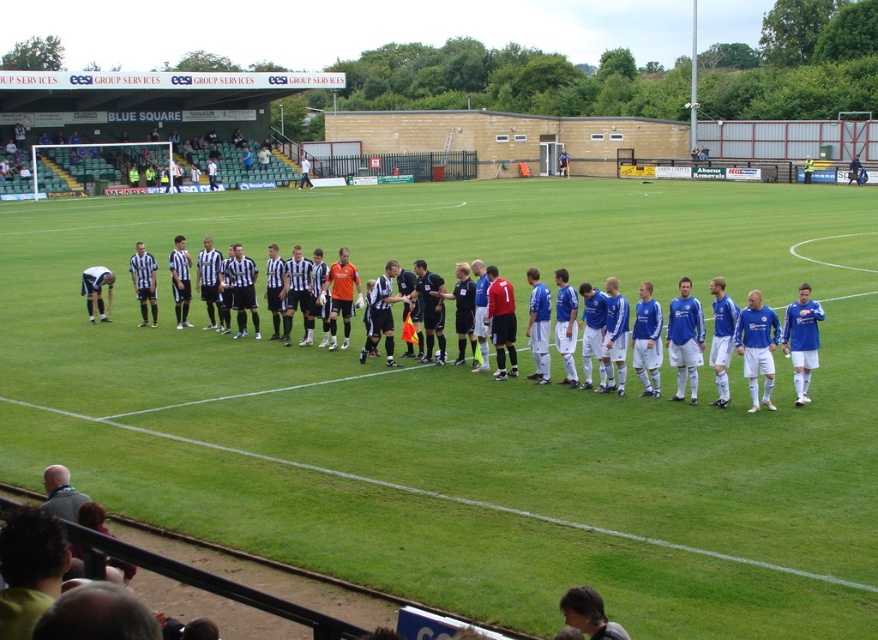
Between smooth brown hair at lower center and light brown leather jacket at lower left, which one appears on the left side from the viewer's perspective?

light brown leather jacket at lower left is more to the left.

Does point (594, 604) come closer to viewer compared to point (59, 486)?

Yes, it is.

Identify the location of smooth brown hair at lower center. The width and height of the screenshot is (878, 640). (588, 612).

Consider the image. Which is more to the right, light brown leather jacket at lower left or striped jersey at center?

light brown leather jacket at lower left is more to the right.

Can you confirm if light brown leather jacket at lower left is positioned to the right of striped jersey at center?

Indeed, light brown leather jacket at lower left is positioned on the right side of striped jersey at center.

Between point (65, 480) and point (131, 262), which one is positioned behind?

Positioned behind is point (131, 262).

Locate an element on the screen. The width and height of the screenshot is (878, 640). light brown leather jacket at lower left is located at coordinates (61, 493).

Does green grass field at center have a larger size compared to smooth brown hair at lower center?

Yes, green grass field at center is bigger than smooth brown hair at lower center.

What do you see at coordinates (473, 404) in the screenshot? I see `green grass field at center` at bounding box center [473, 404].

Is point (484, 381) farther from camera compared to point (573, 620)?

Yes, point (484, 381) is behind point (573, 620).

Identify the location of green grass field at center. (473, 404).